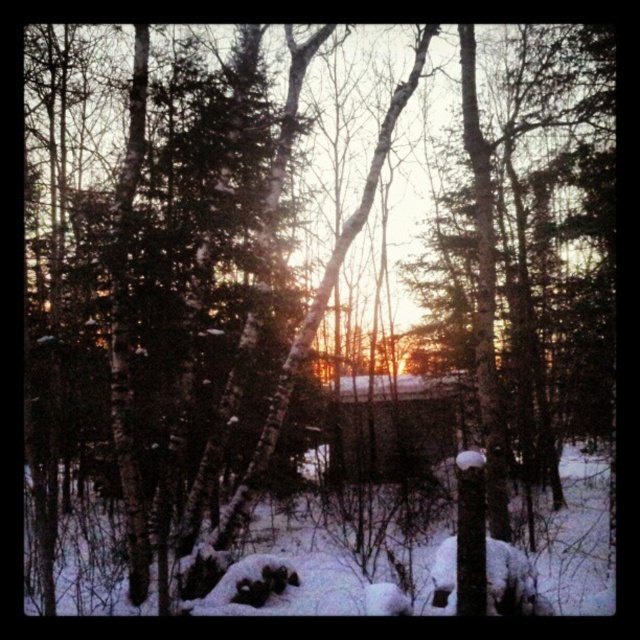
Question: Among these objects, which one is nearest to the camera?

Choices:
 (A) white fluffy snow at center
 (B) brown wooden cabin at center

Answer: (A)

Question: Is white fluffy snow at center to the right of brown wooden cabin at center from the viewer's perspective?

Choices:
 (A) yes
 (B) no

Answer: (A)

Question: Is white fluffy snow at center behind brown wooden cabin at center?

Choices:
 (A) no
 (B) yes

Answer: (A)

Question: Is white fluffy snow at center positioned behind brown wooden cabin at center?

Choices:
 (A) yes
 (B) no

Answer: (B)